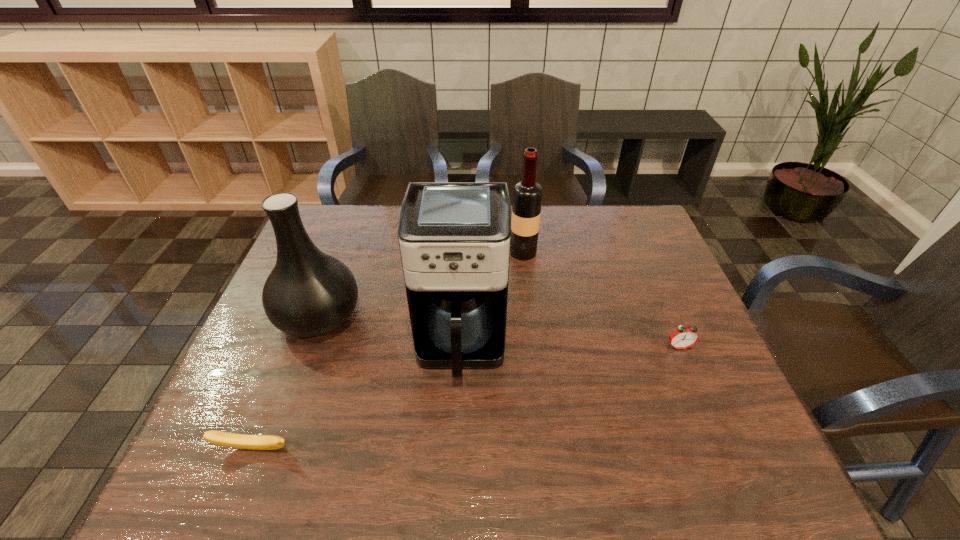
Locate an element on the screen. This screenshot has height=540, width=960. coffee maker is located at coordinates (454, 238).

At what (x,y) coordinates should I click in order to perform the action: click on vase. Please return your answer as a coordinate pair (x, y). The image size is (960, 540). Looking at the image, I should click on (309, 293).

This screenshot has width=960, height=540. Find the location of `wine bottle`. wine bottle is located at coordinates pos(527,194).

The height and width of the screenshot is (540, 960). I want to click on the second object from right to left, so click(527, 194).

Locate an element on the screen. the fourth tallest object is located at coordinates (683, 337).

This screenshot has height=540, width=960. I want to click on alarm clock, so click(x=683, y=337).

At what (x,y) coordinates should I click in order to perform the action: click on banana. Please return your answer as a coordinate pair (x, y). Image resolution: width=960 pixels, height=540 pixels. Looking at the image, I should click on (254, 442).

This screenshot has height=540, width=960. What are the coordinates of `the shortest object` in the screenshot? It's located at (254, 442).

Where is `free space located 0.120m on the front panel of the third object from right to left`? The height and width of the screenshot is (540, 960). free space located 0.120m on the front panel of the third object from right to left is located at coordinates (457, 439).

Find the location of `blank space located on the right of the vase`. blank space located on the right of the vase is located at coordinates (419, 316).